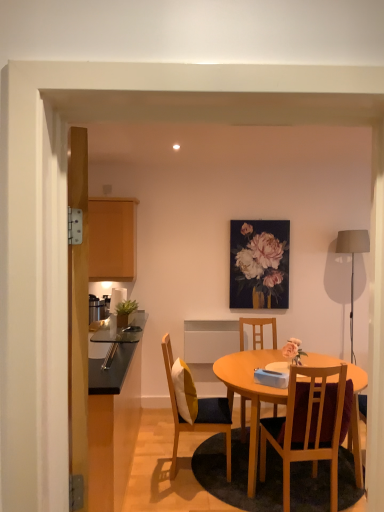
At what (x,y) coordinates should I click in order to perform the action: click on vacant space to the left of wooden chair at center, arranged as the first chair when viewed from the right. Please return your answer as a coordinate pair (x, y). Looking at the image, I should click on (243, 493).